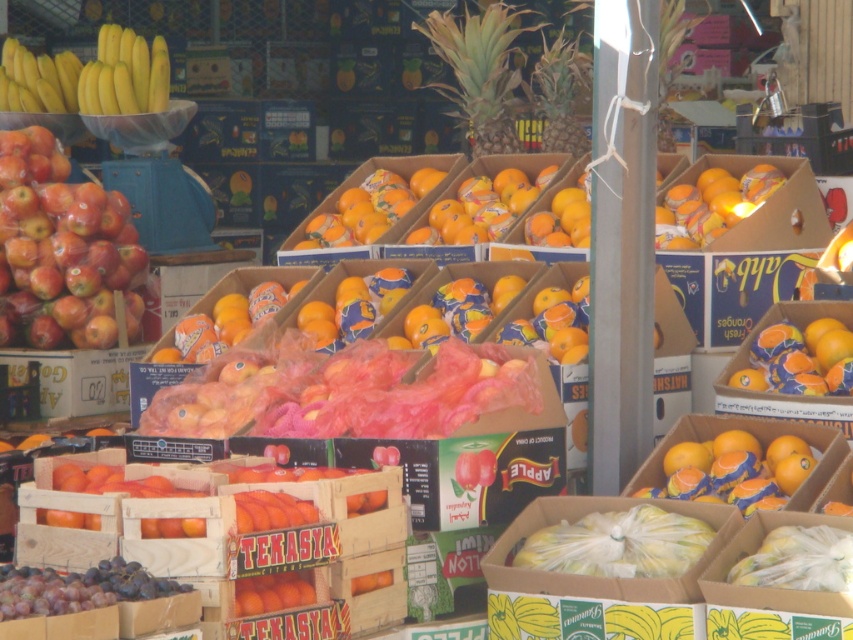
You are standing at the entrance of the fruit market and see two points in the scene, one at point (91, 260) and another at point (96, 68). Which point is closer to you?

Point (91, 260) is closer to the viewer than point (96, 68).

You are a customer at the fruit market and want to find the shiny red apples at left. According to the market layout, where exactly are they positioned?

The shiny red apples at left are located at coordinates point (62, 252).